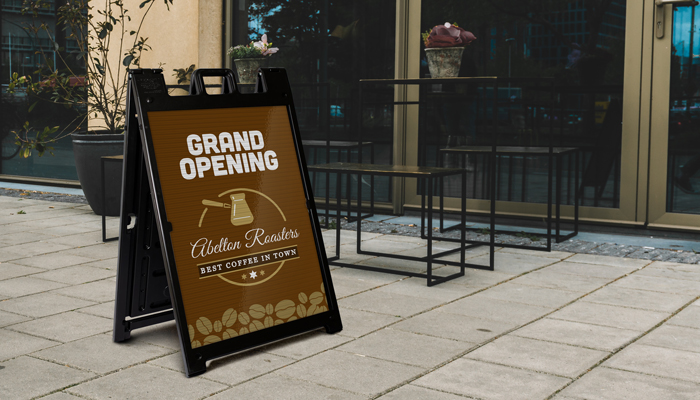
The height and width of the screenshot is (400, 700). What are the coordinates of `plant pot` in the screenshot? It's located at (440, 50).